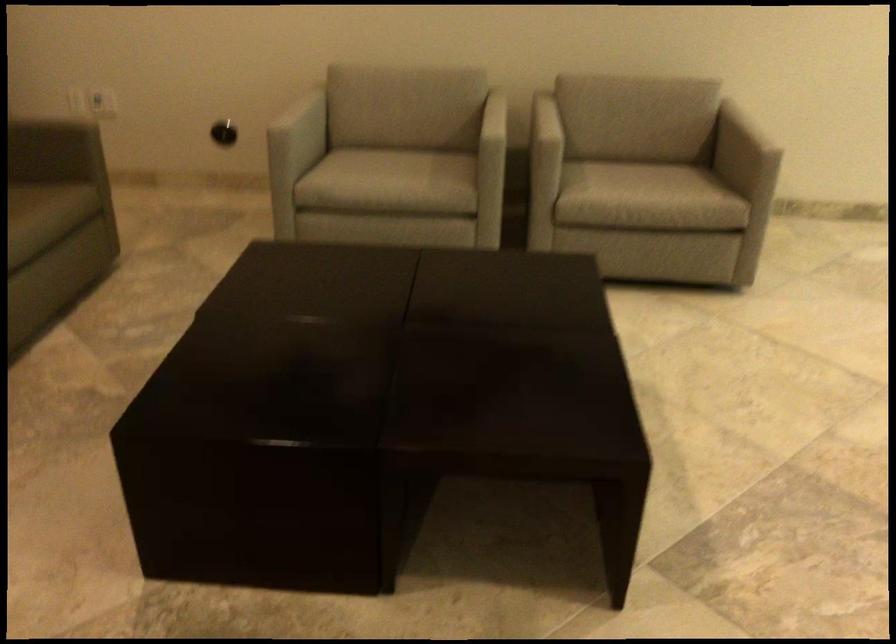
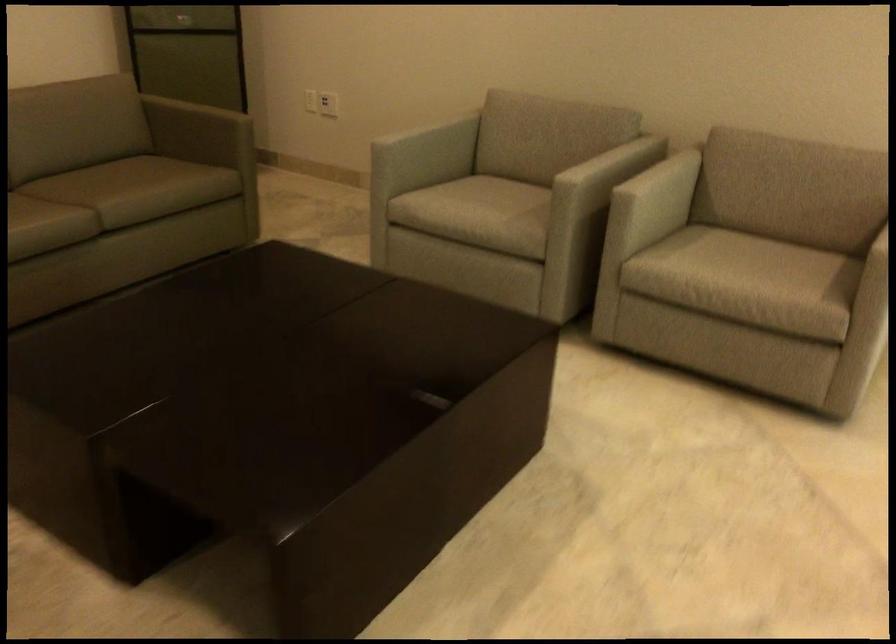
The point at (x=392, y=172) is marked in the first image. Where is the corresponding point in the second image?

(480, 207)